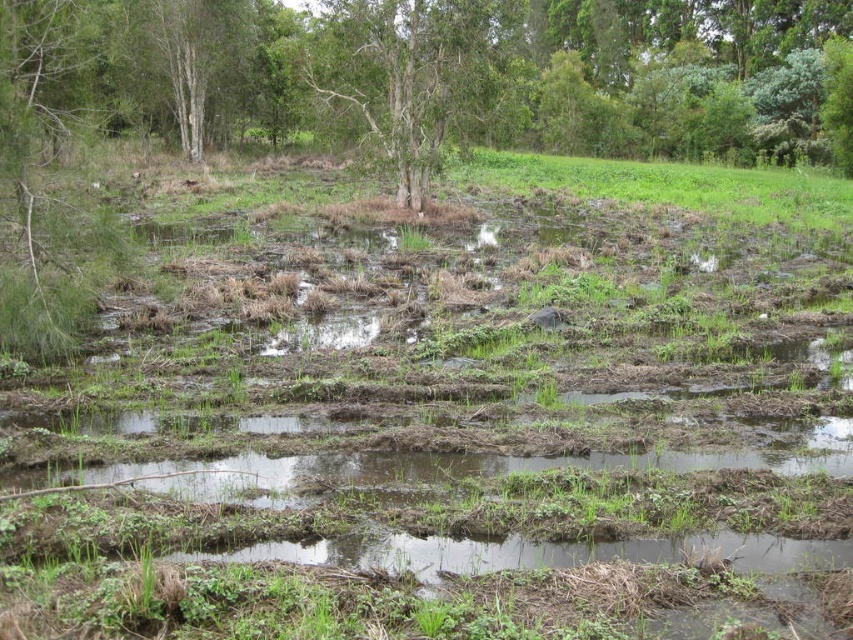
Question: Considering the relative positions of green matte tree at left and green leafy tree at center in the image provided, where is green matte tree at left located with respect to green leafy tree at center?

Choices:
 (A) above
 (B) below

Answer: (B)

Question: Estimate the real-world distances between objects in this image. Which object is farther from the green leafy tree at center?

Choices:
 (A) green matte tree at left
 (B) green matte tree at center

Answer: (A)

Question: Does green matte tree at center come in front of green matte tree at left?

Choices:
 (A) no
 (B) yes

Answer: (B)

Question: Estimate the real-world distances between objects in this image. Which object is farther from the green leafy tree at center?

Choices:
 (A) green matte tree at left
 (B) green matte tree at center

Answer: (A)

Question: Which object is closer to the camera taking this photo?

Choices:
 (A) green matte tree at left
 (B) green leafy tree at center
 (C) green matte tree at center

Answer: (C)

Question: In this image, where is green matte tree at center located relative to green matte tree at left?

Choices:
 (A) below
 (B) above

Answer: (B)